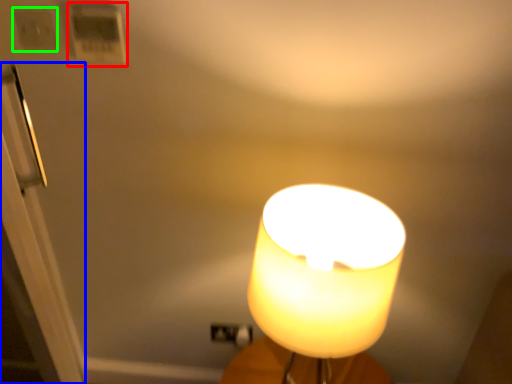
Question: Based on their relative distances, which object is nearer to light switch (highlighted by a red box)? Choose from door (highlighted by a blue box) and light switch (highlighted by a green box).

Choices:
 (A) door
 (B) light switch

Answer: (B)